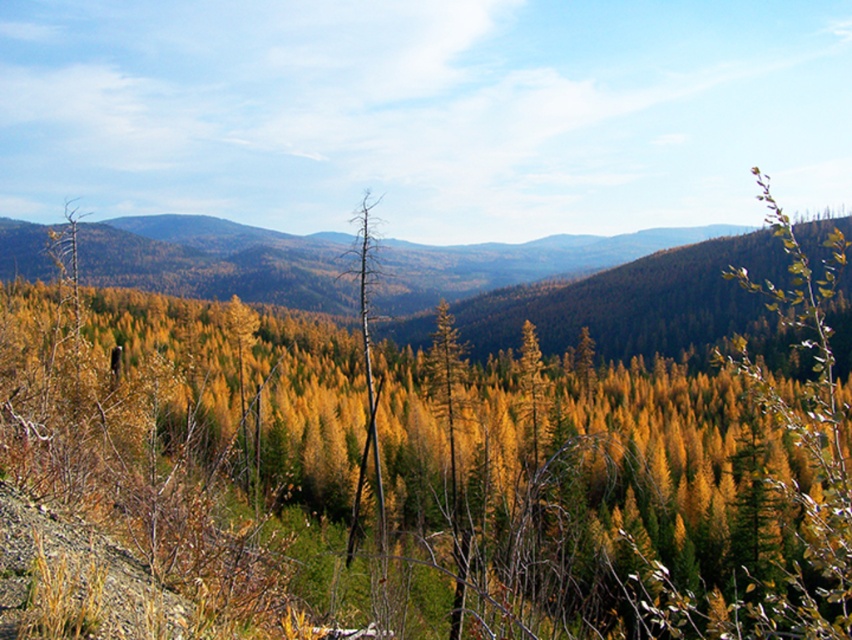
Does point (222, 588) come in front of point (720, 310)?

That is True.

Who is taller, yellow-green foliage at center or green forested mountain at upper center?

With more height is green forested mountain at upper center.

Is point (845, 529) behind point (419, 340)?

No, (845, 529) is closer to viewer.

Locate an element on the screen. yellow-green foliage at center is located at coordinates (438, 467).

Is point (55, 497) in front of point (380, 513)?

Yes, it is in front of point (380, 513).

Is yellow-green foliage at center further to camera compared to dead wood tree at center?

That is False.

I want to click on yellow-green foliage at center, so click(438, 467).

Between green forested mountain at upper center and dead wood tree at center, which one is positioned higher?

green forested mountain at upper center

Can you confirm if green forested mountain at upper center is shorter than dead wood tree at center?

In fact, green forested mountain at upper center may be taller than dead wood tree at center.

Find the location of a particular element. The width and height of the screenshot is (852, 640). green forested mountain at upper center is located at coordinates (634, 301).

Find the location of a particular element. Image resolution: width=852 pixels, height=640 pixels. green forested mountain at upper center is located at coordinates (634, 301).